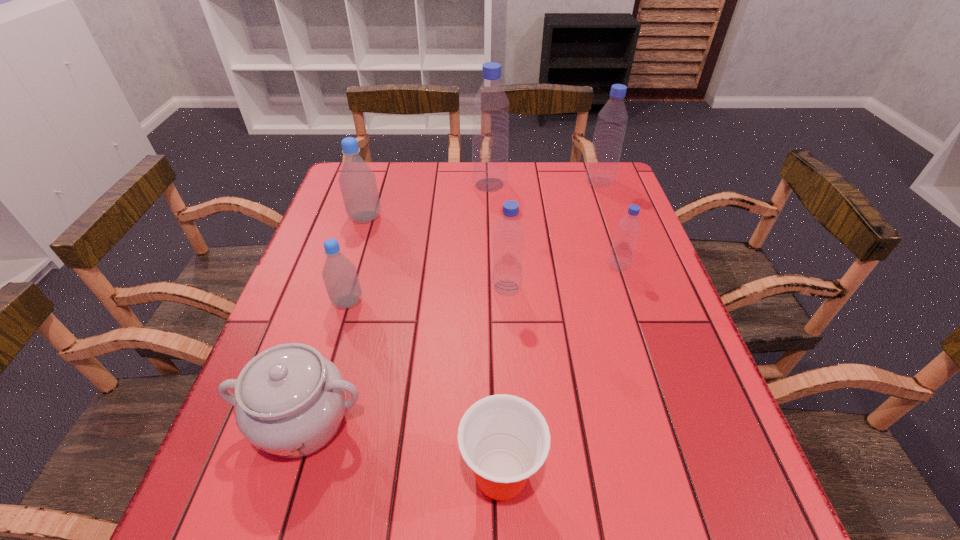
Find the location of a particular element. Image resolution: width=960 pixels, height=540 pixels. chinaware is located at coordinates (289, 400).

Find the location of `the shortest object`. the shortest object is located at coordinates (504, 439).

This screenshot has height=540, width=960. What are the coordinates of `cup` in the screenshot? It's located at tap(504, 439).

You are a GUI agent. You are given a task and a screenshot of the screen. Output one action in this format:
    pyautogui.click(x=<x>, y=<y>)
    Task: Click on the vacant space located on the front of the tallest bottle
    
    Given the screenshot: What is the action you would take?
    pyautogui.click(x=492, y=285)

Where is `vacant area located on the left of the second biggest blue bottle`? The width and height of the screenshot is (960, 540). vacant area located on the left of the second biggest blue bottle is located at coordinates (549, 183).

I want to click on vacant space situated on the back of the third biggest blue bottle, so click(501, 202).

This screenshot has height=540, width=960. Find the location of `free location located 0.110m on the front of the farther gray bottle`. free location located 0.110m on the front of the farther gray bottle is located at coordinates (354, 254).

Find the location of a particular element. The height and width of the screenshot is (540, 960). free space located on the right of the nearer gray bottle is located at coordinates (510, 301).

Find the location of a particular element. The height and width of the screenshot is (540, 960). free location located on the front of the fourth farthest bottle is located at coordinates (663, 404).

The height and width of the screenshot is (540, 960). I want to click on vacant space located on the right of the chinaware, so click(547, 421).